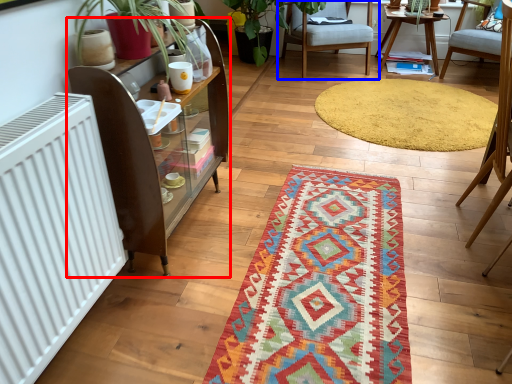
Question: Which object appears closest to the camera in this image, shelf (highlighted by a red box) or chair (highlighted by a blue box)?

Choices:
 (A) shelf
 (B) chair

Answer: (A)